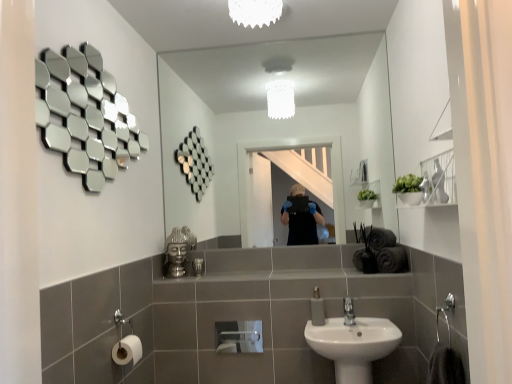
Find the location of a particular element. This screenshot has height=384, width=512. white matte toilet paper at lower left, the first toilet paper from the back is located at coordinates (239, 337).

Measure the distance between white matte toilet paper at lower left, which is counted as the 2th toilet paper, starting from the left, and camera.

3.02 meters.

What is the approximate width of white ceramic sink at lower center?

white ceramic sink at lower center is 13.39 inches wide.

At what (x,y) coordinates should I click in order to perform the action: click on clear glass mirror at center, which is the 2th mirror from left to right. Please return your answer as a coordinate pair (x, y). This screenshot has height=384, width=512. Looking at the image, I should click on (275, 125).

Measure the distance between point (312, 307) and camera.

The distance of point (312, 307) from camera is 7.22 feet.

From the picture: Measure the distance between white frosted glass light fixture at upper center and camera.

white frosted glass light fixture at upper center and camera are 6.46 feet apart.

What do you see at coordinates (255, 12) in the screenshot? I see `white frosted glass light fixture at upper center` at bounding box center [255, 12].

At what (x,y) coordinates should I click in order to perform the action: click on metallic silver toiletry at center. Please return your answer as a coordinate pair (x, y). Looking at the image, I should click on (198, 266).

Is clear glass mirror at center, the first mirror viewed from the right, spatially inside white frosted glass light fixture at upper center, or outside of it?

clear glass mirror at center, the first mirror viewed from the right, cannot be found inside white frosted glass light fixture at upper center.

From a real-world perspective, which mirror is the 2nd one underneath the white frosted glass light fixture at upper center? Please provide its 2D coordinates.

[(275, 125)]

Is clear glass mirror at center, which is counted as the 1th mirror, starting from the back, touching white frosted glass light fixture at upper center?

No.

Which is more to the left, clear glass mirror at center, the second mirror viewed from the front, or white frosted glass light fixture at upper center?

Positioned to the left is white frosted glass light fixture at upper center.

Is point (272, 20) closer or farther from the camera than point (364, 45)?

Point (272, 20) is closer to the camera than point (364, 45).

Is white frosted glass light fixture at upper center outside of clear glass mirror at center, the first mirror viewed from the right?

Absolutely, white frosted glass light fixture at upper center is external to clear glass mirror at center, the first mirror viewed from the right.

Locate an element on the screen. light fixture in front of the clear glass mirror at center, the second mirror viewed from the front is located at coordinates (255, 12).

Looking at this image, in terms of height, does white frosted glass light fixture at upper center look taller or shorter compared to clear glass mirror at center, the second mirror viewed from the front?

In the image, white frosted glass light fixture at upper center appears to be shorter than clear glass mirror at center, the second mirror viewed from the front.

Is clear glass mirror at center, which is the 2th mirror from left to right, far away from white matte soap dispenser at lower center?

Yes, clear glass mirror at center, which is the 2th mirror from left to right, and white matte soap dispenser at lower center are located far from each other.

Can you confirm if clear glass mirror at center, the second mirror viewed from the front, is thinner than white matte soap dispenser at lower center?

Yes.

Does clear glass mirror at center, the first mirror viewed from the right, lie in front of white matte soap dispenser at lower center?

No, clear glass mirror at center, the first mirror viewed from the right, is further to the viewer.

Considering the points (346, 309) and (129, 350), which point is in front, point (346, 309) or point (129, 350)?

The point (129, 350) is closer.

Is silver metallic faucet at lower center taller than white matte toilet paper at lower left, which ranks as the 2th toilet paper in back-to-front order?

Yes.

Is silver metallic faucet at lower center situated inside white matte toilet paper at lower left, which ranks as the second toilet paper in right-to-left order, or outside?

silver metallic faucet at lower center exists outside the volume of white matte toilet paper at lower left, which ranks as the second toilet paper in right-to-left order.

From the image's perspective, would you say white frosted glass light fixture at upper center is shown under white matte toilet paper at lower left, which is the 1th toilet paper in right-to-left order?

No.

Considering the sizes of objects white frosted glass light fixture at upper center and white matte toilet paper at lower left, which is the 2th toilet paper from front to back, in the image provided, who is taller, white frosted glass light fixture at upper center or white matte toilet paper at lower left, which is the 2th toilet paper from front to back,?

Standing taller between the two is white matte toilet paper at lower left, which is the 2th toilet paper from front to back.

Measure the distance between white frosted glass light fixture at upper center and white matte toilet paper at lower left, which is the 1th toilet paper in right-to-left order.

A distance of 2.25 meters exists between white frosted glass light fixture at upper center and white matte toilet paper at lower left, which is the 1th toilet paper in right-to-left order.

Is white frosted glass light fixture at upper center outside of white matte toilet paper at lower left, which is the 2th toilet paper from front to back?

Yes, white frosted glass light fixture at upper center is located beyond the bounds of white matte toilet paper at lower left, which is the 2th toilet paper from front to back.

Is white matte soap dispenser at lower center inside silver metallic faucet at lower center?

No, white matte soap dispenser at lower center is located outside of silver metallic faucet at lower center.

Is silver metallic faucet at lower center taller or shorter than white matte soap dispenser at lower center?

silver metallic faucet at lower center is shorter than white matte soap dispenser at lower center.

In the image, is silver metallic faucet at lower center positioned in front of or behind white matte soap dispenser at lower center?

Visually, silver metallic faucet at lower center is located in front of white matte soap dispenser at lower center.

From the image's perspective, would you say silver metallic faucet at lower center is shown under white matte soap dispenser at lower center?

Yes, from the image's perspective, silver metallic faucet at lower center is below white matte soap dispenser at lower center.

Is white matte toilet paper at lower left, the first toilet paper from the back, turned away from white matte toilet paper at lower left, the 1th toilet paper viewed from the front?

No, white matte toilet paper at lower left, the 1th toilet paper viewed from the front, is not at the back of white matte toilet paper at lower left, the first toilet paper from the back.

Looking at their sizes, would you say white matte toilet paper at lower left, which is the 2th toilet paper from front to back, is wider or thinner than white matte toilet paper at lower left, which ranks as the 2th toilet paper in back-to-front order?

white matte toilet paper at lower left, which is the 2th toilet paper from front to back, is thinner than white matte toilet paper at lower left, which ranks as the 2th toilet paper in back-to-front order.

Between point (240, 322) and point (135, 364), which one is positioned in front?

The point (135, 364) is closer.

Is white matte toilet paper at lower left, the first toilet paper from the back, bigger than white matte toilet paper at lower left, the 1th toilet paper viewed from the front?

No, white matte toilet paper at lower left, the first toilet paper from the back, is not bigger than white matte toilet paper at lower left, the 1th toilet paper viewed from the front.

Locate an element on the screen. mirror behind the white frosted glass light fixture at upper center is located at coordinates (275, 125).

This screenshot has width=512, height=384. There is a clear glass mirror at center, which is the 2th mirror from left to right. Find the location of `light fixture above it (from a real-world perspective)`. light fixture above it (from a real-world perspective) is located at coordinates (255, 12).

Looking at the image, which one is located further to shiny metallic hexagons at upper left, the 2th mirror in the back-to-front sequence, metallic silver toiletry at center or silver metallic faucet at lower center?

silver metallic faucet at lower center.

Looking at the image, which one is located closer to clear glass mirror at center, the first mirror viewed from the right, white matte soap dispenser at lower center or white frosted glass light fixture at upper center?

white frosted glass light fixture at upper center lies closer to clear glass mirror at center, the first mirror viewed from the right, than the other object.

Based on their spatial positions, is metallic silver toiletry at center or white matte toilet paper at lower left, which is the 1th toilet paper in right-to-left order, further from shiny metallic hexagons at upper left, marked as the second mirror in a right-to-left arrangement?

white matte toilet paper at lower left, which is the 1th toilet paper in right-to-left order.

When comparing their distances from white matte toilet paper at lower left, which is the 2th toilet paper from front to back, does metallic silver toiletry at center or white matte toilet paper at lower left, the 1th toilet paper positioned from the left, seem closer?

Among the two, metallic silver toiletry at center is located nearer to white matte toilet paper at lower left, which is the 2th toilet paper from front to back.

From the picture: Based on their spatial positions, is metallic silver toiletry at center or white ceramic sink at lower center closer to white matte toilet paper at lower left, the 1th toilet paper positioned from the left?

Result: Among the two, metallic silver toiletry at center is located nearer to white matte toilet paper at lower left, the 1th toilet paper positioned from the left.

Looking at the image, which one is located closer to clear glass mirror at center, which is the 2th mirror from left to right, white ceramic sink at lower center or metallic silver toiletry at center?

Among the two, white ceramic sink at lower center is located nearer to clear glass mirror at center, which is the 2th mirror from left to right.

From the image, which object appears to be farther from metallic silver toiletry at center, white frosted glass light fixture at upper center or white matte toilet paper at lower left, which ranks as the 2th toilet paper in back-to-front order?

Among the two, white frosted glass light fixture at upper center is located further to metallic silver toiletry at center.

Based on their spatial positions, is white ceramic sink at lower center or white matte soap dispenser at lower center closer to clear glass mirror at center, the first mirror viewed from the right?

white ceramic sink at lower center lies closer to clear glass mirror at center, the first mirror viewed from the right, than the other object.

Where is `mirror between shiny metallic hexagons at upper left, the 2th mirror in the back-to-front sequence, and white matte toilet paper at lower left, which is the 1th toilet paper in right-to-left order, from top to bottom`? This screenshot has width=512, height=384. mirror between shiny metallic hexagons at upper left, the 2th mirror in the back-to-front sequence, and white matte toilet paper at lower left, which is the 1th toilet paper in right-to-left order, from top to bottom is located at coordinates (275, 125).

The width and height of the screenshot is (512, 384). In order to click on soap dispenser located between metallic silver toiletry at center and silver metallic faucet at lower center in the left-right direction in this screenshot , I will do `click(317, 308)`.

Find the location of a particular element. The image size is (512, 384). soap dispenser between shiny metallic hexagons at upper left, marked as the second mirror in a right-to-left arrangement, and white matte toilet paper at lower left, which ranks as the 2th toilet paper in back-to-front order, in the up-down direction is located at coordinates (317, 308).

At what (x,y) coordinates should I click in order to perform the action: click on toiletry that lies between white frosted glass light fixture at upper center and white matte toilet paper at lower left, which ranks as the second toilet paper in right-to-left order, from top to bottom. Please return your answer as a coordinate pair (x, y). Looking at the image, I should click on (198, 266).